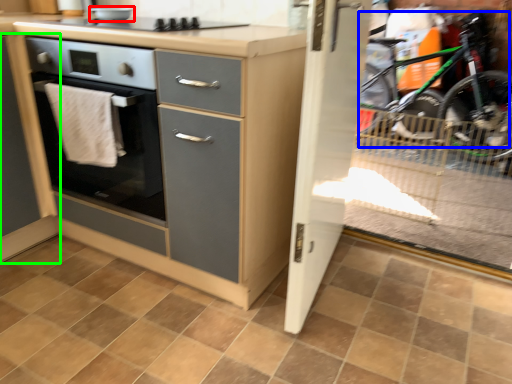
Question: Which object is positioned farthest from appliance (highlighted by a red box)? Select from mountain bike (highlighted by a blue box) and cabinetry (highlighted by a green box).

Choices:
 (A) mountain bike
 (B) cabinetry

Answer: (A)